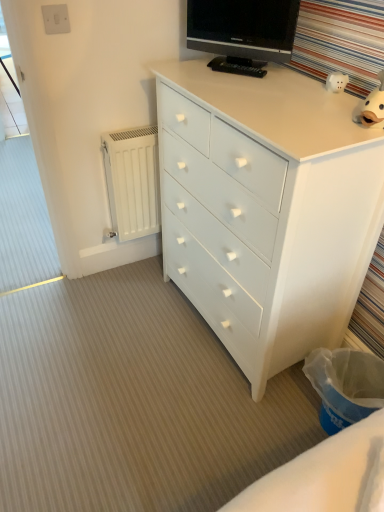
You are a GUI agent. You are given a task and a screenshot of the screen. Output one action in this format:
    pyautogui.click(x=<x>, y=<y>)
    Task: Click on the free space in front of white glossy piggy bank at upper right
    The height and width of the screenshot is (512, 384).
    Given the screenshot: What is the action you would take?
    pyautogui.click(x=337, y=104)